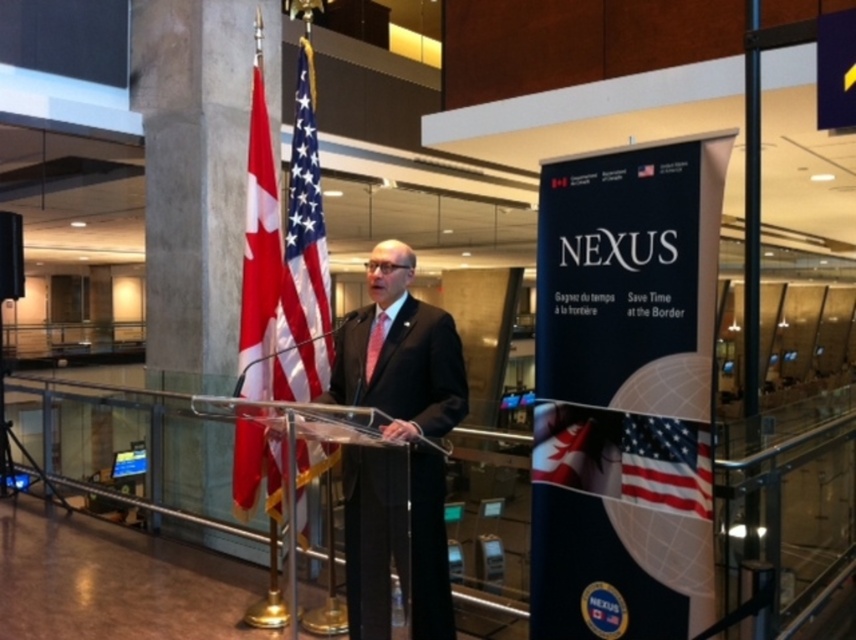
You are attending the event and need to position yourself between the two points, point (389, 358) and point (375, 342). Which point should you stand closer to if you want to be closer to the speaker?

You should stand closer to point (389, 358) because it is in front of point (375, 342), meaning it is closer to the speaker who is at the podium.

You are standing in the atrium and want to reach the point marked at coordinates point (354,513). Given that the distance from your current position to that point is 3.16 meters, how many steps would it take you to walk there if each step covers approximately 0.75 meters?

The point (354,513) is 3.16 meters away. Dividing the total distance by the step length gives 3.16 divided by 0.75, which equals approximately 4.21 steps. Since you can only take whole steps, you would need to take 5 steps to reach the point (354,513).

You are attending a formal event and notice a specific point marked at coordinates (395, 540). Based on the scene description, where on the man in the black suit at center would this point be located?

The point at coordinates (395, 540) is located on the black suit at center.